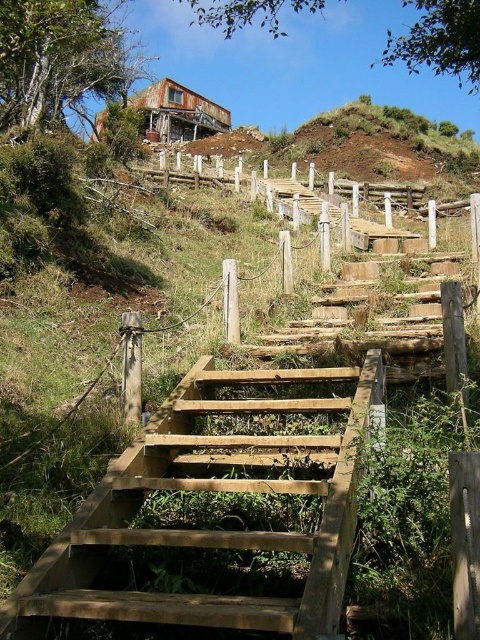
Which is below, natural wood stairs at center or wooden fence at upper center?

natural wood stairs at center is below.

Is natural wood stairs at center shorter than wooden fence at upper center?

Yes.

Between point (236, 371) and point (241, 180), which one is positioned in front?

Positioned in front is point (236, 371).

I want to click on natural wood stairs at center, so click(x=215, y=490).